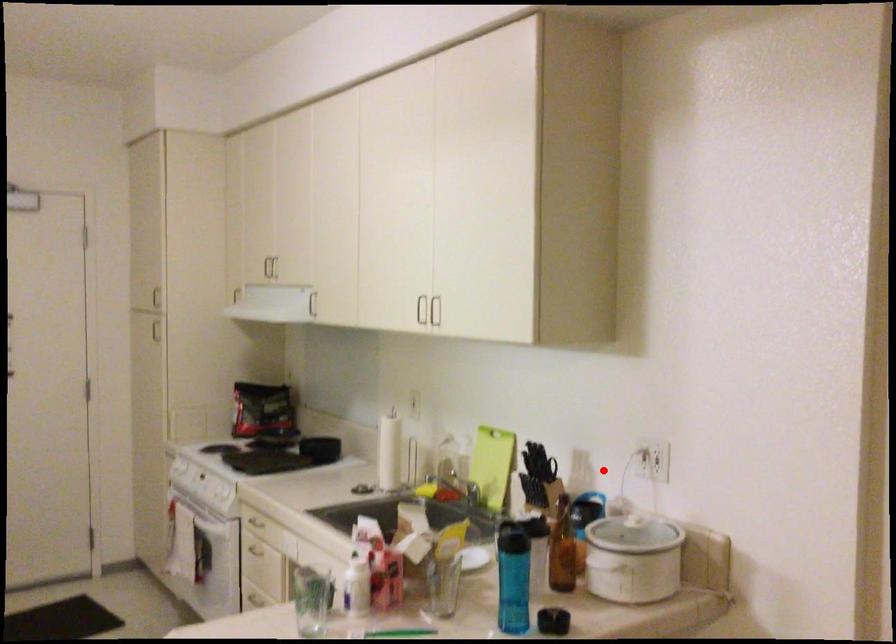
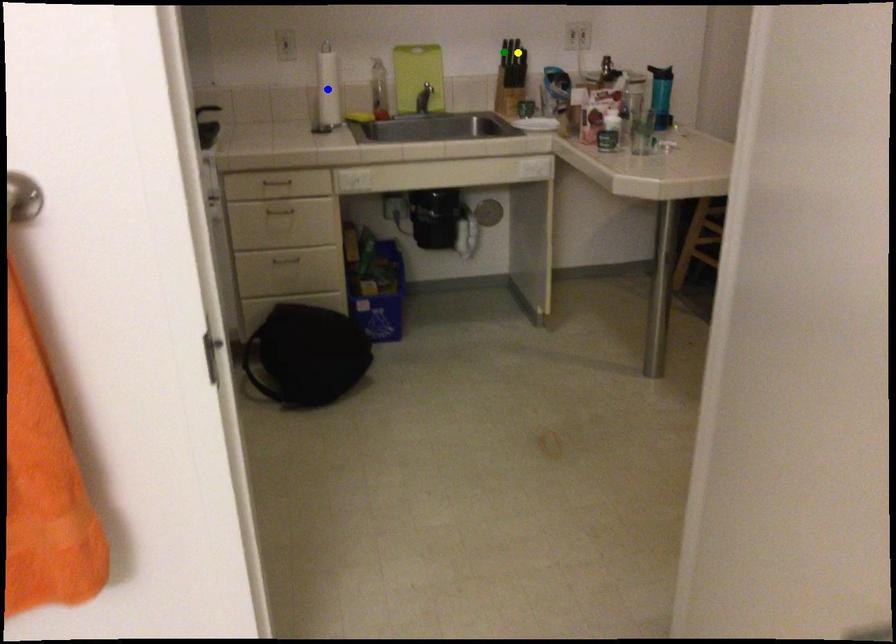
Question: I am providing you with two images of the same scene from different viewpoints. A red point is marked on the first image. You are given multiple points on the second image. Which point in image 2 is actually the same real-world point as the red point in image 1?

Choices:
 (A) yellow point
 (B) blue point
 (C) green point

Answer: (A)